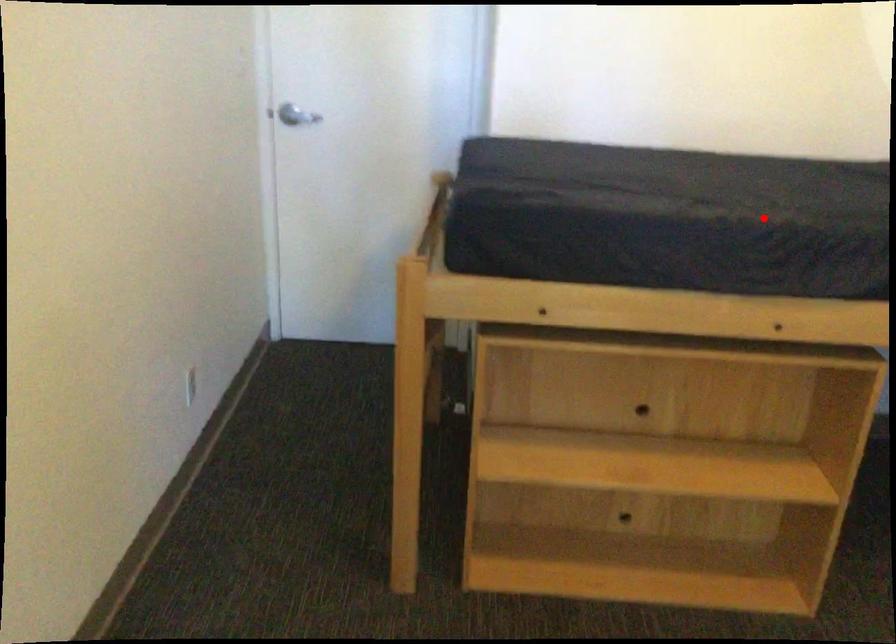
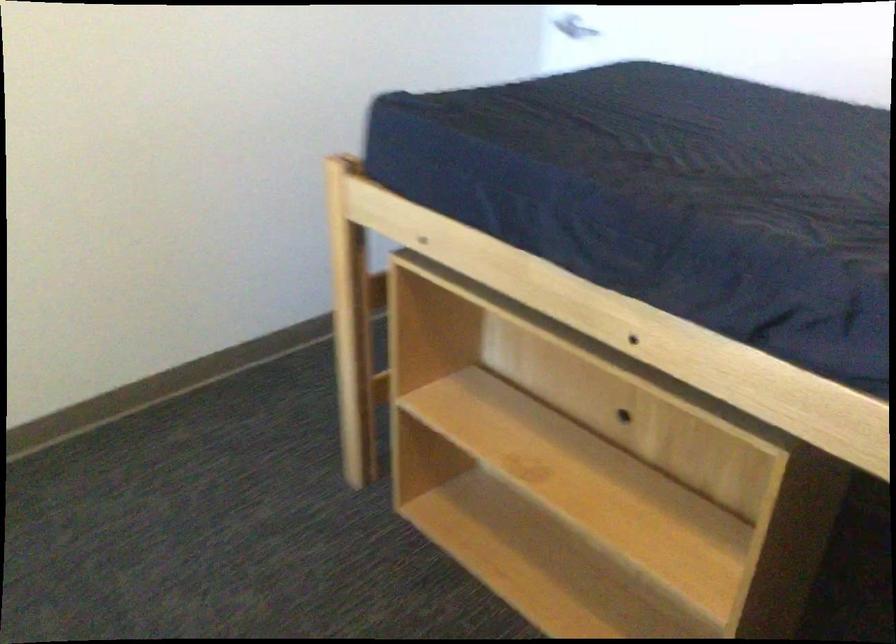
In the second image, find the point that corresponds to the highlighted location in the first image.

(651, 193)